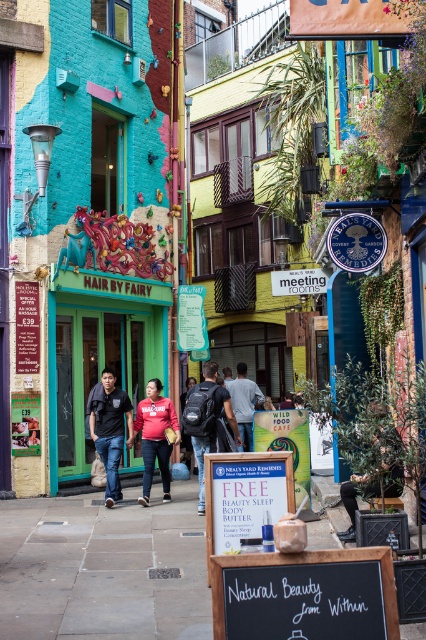
You are a traveler standing in the middle of this colorful street. You have a matte gray backpack at center and a red cotton hoodie at center. Which item is shorter in height?

The matte gray backpack at center is shorter than the red cotton hoodie at center.

You are a delivery person who needs to place a fragile package on the smooth stone pavement at center or the matte gray backpack at center. Which surface is more suitable for placing the package to avoid damage?

The smooth stone pavement at center is thinner than the matte gray backpack at center, so the backpack is a better surface for placing the fragile package as it provides more cushioning and stability.